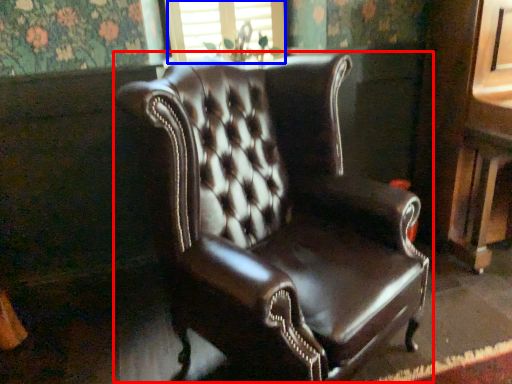
Question: Which object appears closest to the camera in this image, chair (highlighted by a red box) or window frame (highlighted by a blue box)?

Choices:
 (A) chair
 (B) window frame

Answer: (A)